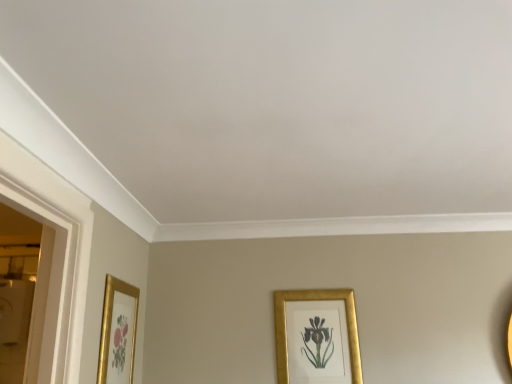
Question: From the image's perspective, is gold metallic picture frame at lower left, which ranks as the 1th picture frame in front-to-back order, above or below gold metallic picture frame at lower center, marked as the second picture frame in a front-to-back arrangement?

Choices:
 (A) above
 (B) below

Answer: (A)

Question: In the image, is gold metallic picture frame at lower left, the 1th picture frame viewed from the left, on the left side or the right side of gold metallic picture frame at lower center, marked as the first picture frame in a back-to-front arrangement?

Choices:
 (A) right
 (B) left

Answer: (B)

Question: Is gold metallic picture frame at lower left, the 1th picture frame viewed from the left, situated inside gold metallic picture frame at lower center, marked as the second picture frame in a front-to-back arrangement, or outside?

Choices:
 (A) outside
 (B) inside

Answer: (A)

Question: From the image's perspective, is gold metallic picture frame at lower center, marked as the first picture frame in a back-to-front arrangement, above or below gold metallic picture frame at lower left, which ranks as the 1th picture frame in front-to-back order?

Choices:
 (A) below
 (B) above

Answer: (A)

Question: Based on their sizes in the image, would you say gold metallic picture frame at lower center, marked as the second picture frame in a front-to-back arrangement, is bigger or smaller than gold metallic picture frame at lower left, the 1th picture frame viewed from the left?

Choices:
 (A) small
 (B) big

Answer: (B)

Question: Considering the relative positions of gold metallic picture frame at lower center, which is the 1th picture frame in right-to-left order, and gold metallic picture frame at lower left, the 2th picture frame positioned from the back, in the image provided, is gold metallic picture frame at lower center, which is the 1th picture frame in right-to-left order, to the left or to the right of gold metallic picture frame at lower left, the 2th picture frame positioned from the back,?

Choices:
 (A) left
 (B) right

Answer: (B)

Question: From a real-world perspective, is gold metallic picture frame at lower center, marked as the first picture frame in a back-to-front arrangement, above or below gold metallic picture frame at lower left, the 1th picture frame viewed from the left?

Choices:
 (A) above
 (B) below

Answer: (B)